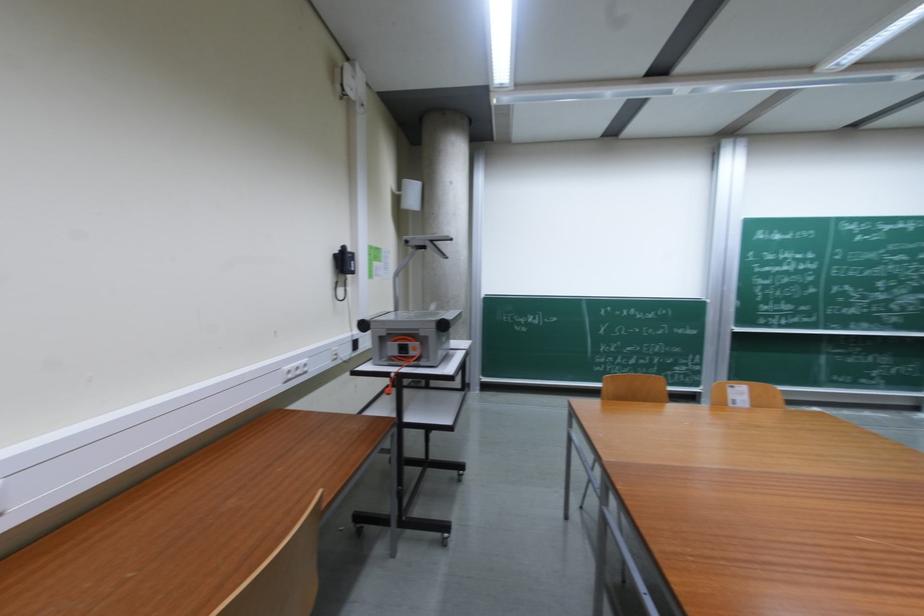
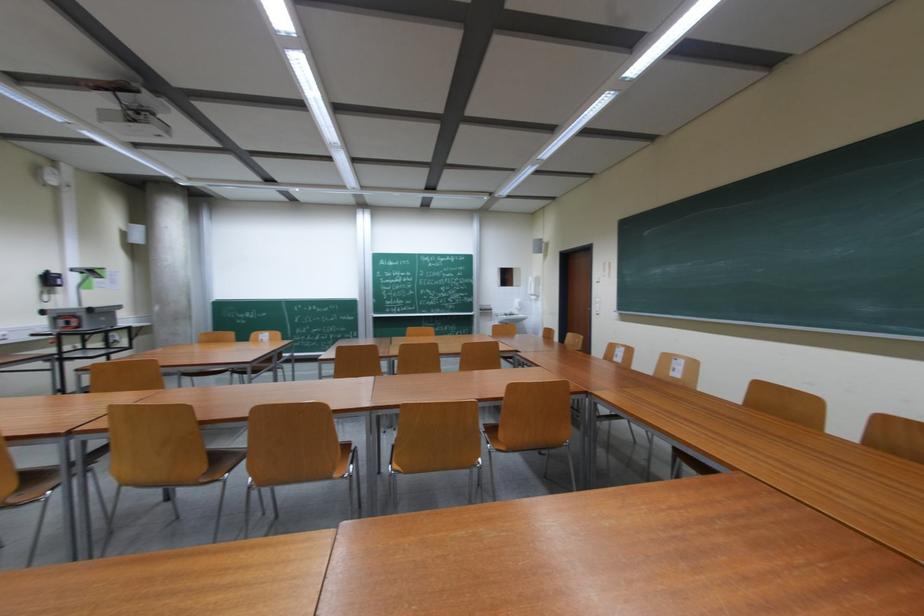
In a continuous first-person perspective shot, in which direction is the camera moving?

The cameraman moved toward right, backward.